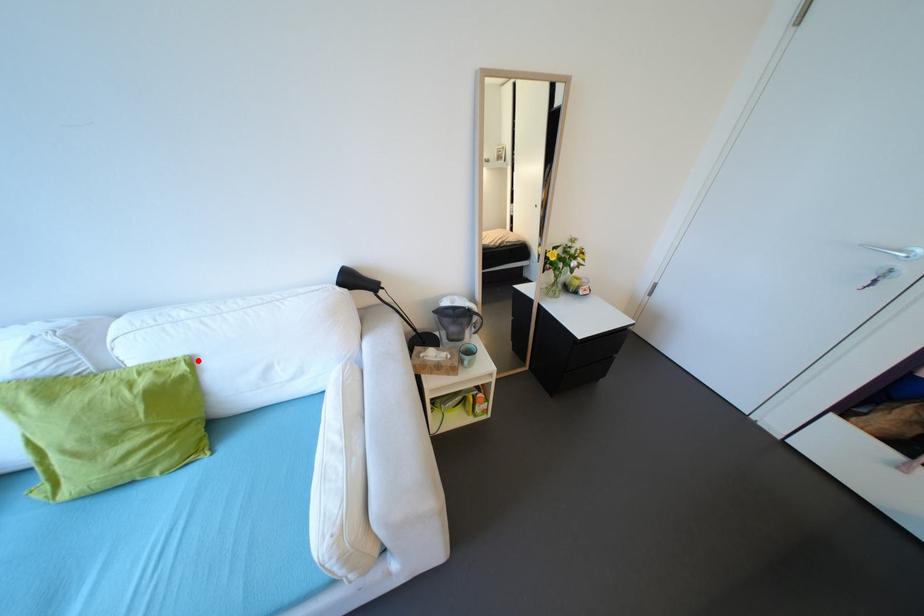
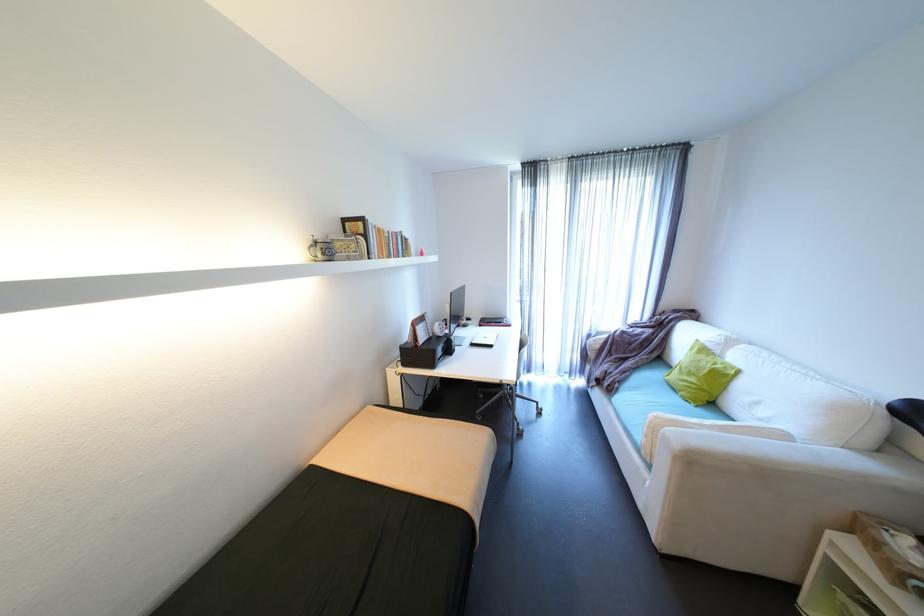
Where in the second image is the point corresponding to the highlighted location from the first image?

(747, 371)